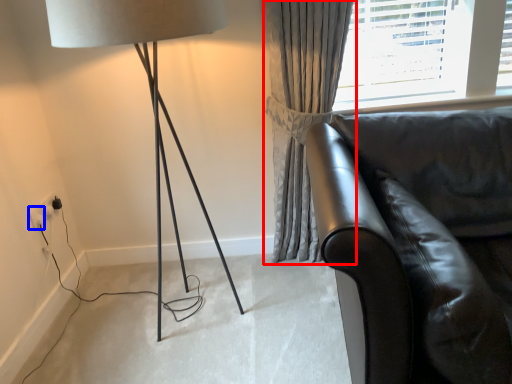
Question: Which object appears farthest to the camera in this image, curtain (highlighted by a red box) or electric outlet (highlighted by a blue box)?

Choices:
 (A) curtain
 (B) electric outlet

Answer: (B)